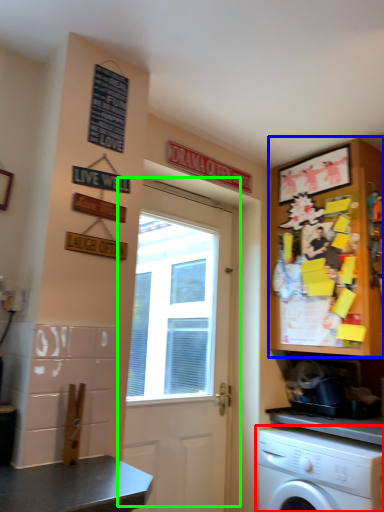
Question: Considering the real-world distances, which object is farthest from washing machine (highlighted by a red box)? cabinetry (highlighted by a blue box) or door (highlighted by a green box)?

Choices:
 (A) cabinetry
 (B) door

Answer: (B)